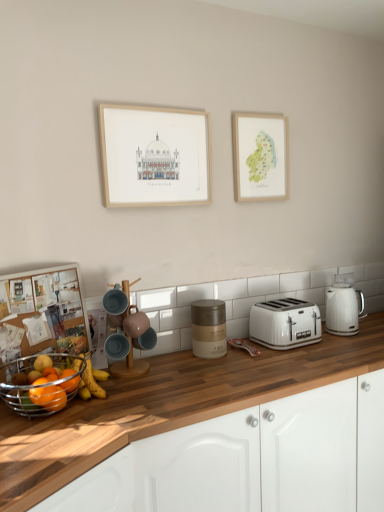
Identify the location of free space between matte gold canister at center, the 2th appliance viewed from the right, and matte ceramic coffee machine at center. (172, 362).